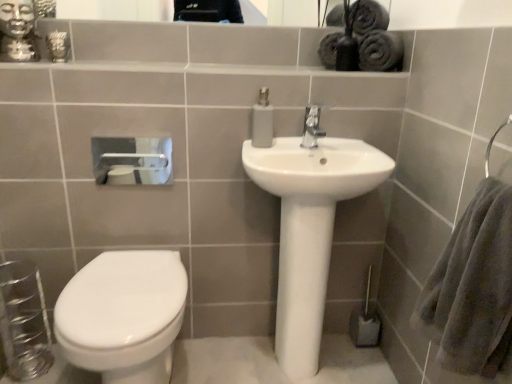
Locate an element on the screen. silver metallic faucet at center is located at coordinates (312, 127).

The height and width of the screenshot is (384, 512). Describe the element at coordinates (448, 13) in the screenshot. I see `glossy ceramic mirror at upper center` at that location.

This screenshot has height=384, width=512. What are the coordinates of `white glossy toilet at lower left` in the screenshot? It's located at (123, 315).

Describe the element at coordinates (123, 315) in the screenshot. I see `white glossy toilet at lower left` at that location.

Where is `matte gray plastic soap dispenser at upper center`? matte gray plastic soap dispenser at upper center is located at coordinates [x=262, y=121].

At what (x,y) coordinates should I click in order to perform the action: click on white glossy sink at center. Please return your answer as a coordinate pair (x, y). The height and width of the screenshot is (384, 512). Looking at the image, I should click on (309, 229).

Identify the location of silver metallic faucet at center. The image size is (512, 384). (312, 127).

Consider the image. Is silver metallic faucet at center looking in the opposite direction of white glossy sink at center?

That's not correct — silver metallic faucet at center is not looking away from white glossy sink at center.

Can you tell me how much silver metallic faucet at center and white glossy sink at center differ in facing direction?

0.000223 degrees separate the facing orientations of silver metallic faucet at center and white glossy sink at center.

Considering the positions of objects silver metallic faucet at center and white glossy sink at center in the image provided, who is in front, silver metallic faucet at center or white glossy sink at center?

white glossy sink at center.

Considering the sizes of silver metallic faucet at center and white glossy sink at center in the image, is silver metallic faucet at center taller or shorter than white glossy sink at center?

silver metallic faucet at center is shorter than white glossy sink at center.

Considering the sizes of objects white matte toilet paper at upper left and matte gray plastic soap dispenser at upper center in the image provided, who is smaller, white matte toilet paper at upper left or matte gray plastic soap dispenser at upper center?

white matte toilet paper at upper left.

Is white matte toilet paper at upper left not near matte gray plastic soap dispenser at upper center?

Absolutely, white matte toilet paper at upper left is distant from matte gray plastic soap dispenser at upper center.

Would you say white matte toilet paper at upper left is outside matte gray plastic soap dispenser at upper center?

Indeed, white matte toilet paper at upper left is completely outside matte gray plastic soap dispenser at upper center.

Could you tell me if white matte toilet paper at upper left is turned towards matte gray plastic soap dispenser at upper center?

No, white matte toilet paper at upper left is not aimed at matte gray plastic soap dispenser at upper center.

From a real-world perspective, is gray fluffy bath towel at right under white glossy sink at center?

No.

Is gray fluffy bath towel at right inside or outside of white glossy sink at center?

gray fluffy bath towel at right is not inside white glossy sink at center, it's outside.

From the image's perspective, is gray fluffy bath towel at right located above white glossy sink at center?

Yes, from the image's perspective, gray fluffy bath towel at right is on top of white glossy sink at center.

What's the angular difference between gray fluffy bath towel at right and white glossy sink at center's facing directions?

They differ by 88.5 degrees in their facing directions.

In terms of height, does white glossy sink at center look taller or shorter compared to white matte toilet paper at upper left?

white glossy sink at center is taller than white matte toilet paper at upper left.

Based on the photo, is white glossy sink at center positioned beyond the bounds of white matte toilet paper at upper left?

Yes, white glossy sink at center is outside of white matte toilet paper at upper left.

From a real-world perspective, is white glossy sink at center positioned above or below white matte toilet paper at upper left?

white glossy sink at center is below white matte toilet paper at upper left.

Does silver metallic faucet at center appear on the left side of white matte toilet paper at upper left?

No, silver metallic faucet at center is not to the left of white matte toilet paper at upper left.

Does silver metallic faucet at center touch white matte toilet paper at upper left?

No, silver metallic faucet at center is not touching white matte toilet paper at upper left.

Considering the sizes of objects silver metallic faucet at center and white matte toilet paper at upper left in the image provided, who is shorter, silver metallic faucet at center or white matte toilet paper at upper left?

Standing shorter between the two is silver metallic faucet at center.

You are a GUI agent. You are given a task and a screenshot of the screen. Output one action in this format:
    pyautogui.click(x=<x>, y=<y>)
    Task: Click on the tap above the white matte toilet paper at upper left (from the image's perspective)
    The width and height of the screenshot is (512, 384).
    Given the screenshot: What is the action you would take?
    pyautogui.click(x=312, y=127)

Is white glossy toilet at lower left bigger or smaller than matte gray plastic soap dispenser at upper center?

Considering their sizes, white glossy toilet at lower left takes up more space than matte gray plastic soap dispenser at upper center.

Does point (88, 266) appear closer or farther from the camera than point (260, 138)?

Clearly, point (88, 266) is closer to the camera than point (260, 138).

Is white glossy toilet at lower left completely or partially outside of matte gray plastic soap dispenser at upper center?

white glossy toilet at lower left lies outside matte gray plastic soap dispenser at upper center's area.

From their relative heights in the image, would you say white glossy toilet at lower left is taller or shorter than matte gray plastic soap dispenser at upper center?

Considering their sizes, white glossy toilet at lower left has more height than matte gray plastic soap dispenser at upper center.

Who is more distant, glossy ceramic mirror at upper center or white matte toilet paper at upper left?

glossy ceramic mirror at upper center is more distant.

Would you consider glossy ceramic mirror at upper center to be distant from white matte toilet paper at upper left?

Yes, glossy ceramic mirror at upper center and white matte toilet paper at upper left are quite far apart.

Choose the correct answer: Is glossy ceramic mirror at upper center inside white matte toilet paper at upper left or outside it?

glossy ceramic mirror at upper center lies outside white matte toilet paper at upper left.

Which is in front, point (415, 7) or point (92, 149)?

The point (415, 7) is more forward.

Identify the location of sink on the left side of silver metallic faucet at center. (309, 229).

Locate an element on the screen. Image resolution: width=512 pixels, height=384 pixels. soap dispenser that appears above the white matte toilet paper at upper left (from the image's perspective) is located at coordinates (262, 121).

Based on their spatial positions, is matte gray plastic soap dispenser at upper center or white glossy toilet at lower left further from silver metallic faucet at center?

white glossy toilet at lower left is positioned further to the anchor silver metallic faucet at center.

Looking at the image, which one is located further to white matte toilet paper at upper left, white glossy toilet at lower left or silver metallic faucet at center?

The object further to white matte toilet paper at upper left is silver metallic faucet at center.

Based on the photo, considering their positions, is white glossy sink at center positioned closer to white glossy toilet at lower left than white matte toilet paper at upper left?

The object closer to white glossy toilet at lower left is white glossy sink at center.

Based on their spatial positions, is silver metallic faucet at center or glossy ceramic mirror at upper center closer to gray fluffy bath towel at right?

silver metallic faucet at center is closer to gray fluffy bath towel at right.

From the picture: Based on their spatial positions, is matte gray plastic soap dispenser at upper center or silver metallic faucet at center closer to white glossy toilet at lower left?

matte gray plastic soap dispenser at upper center.

From the image, which object appears to be nearer to gray fluffy bath towel at right, white matte toilet paper at upper left or gold metallic statue at upper left?

gold metallic statue at upper left is closer to gray fluffy bath towel at right.

Considering their positions, is silver metallic faucet at center positioned closer to matte gray plastic soap dispenser at upper center than white glossy toilet at lower left?

silver metallic faucet at center is positioned closer to the anchor matte gray plastic soap dispenser at upper center.

Looking at this image, based on their spatial positions, is gray fluffy bath towel at right or matte gray plastic soap dispenser at upper center closer to glossy ceramic mirror at upper center?

The object closer to glossy ceramic mirror at upper center is matte gray plastic soap dispenser at upper center.

The height and width of the screenshot is (384, 512). I want to click on toilet situated between gold metallic statue at upper left and gray fluffy bath towel at right from left to right, so click(123, 315).

Identify the location of soap dispenser between glossy ceramic mirror at upper center and white matte toilet paper at upper left from top to bottom. This screenshot has width=512, height=384. (262, 121).

Locate an element on the screen. Image resolution: width=512 pixels, height=384 pixels. mirror located between gold metallic statue at upper left and matte gray plastic soap dispenser at upper center in the left-right direction is located at coordinates (448, 13).

I want to click on sink between matte gray plastic soap dispenser at upper center and white glossy toilet at lower left in the up-down direction, so click(309, 229).